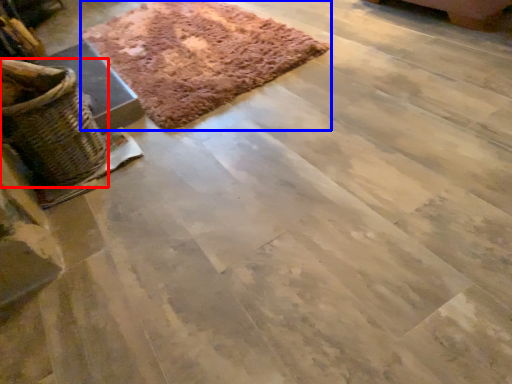
Question: Among these objects, which one is nearest to the camera, basket (highlighted by a red box) or mat (highlighted by a blue box)?

Choices:
 (A) basket
 (B) mat

Answer: (A)